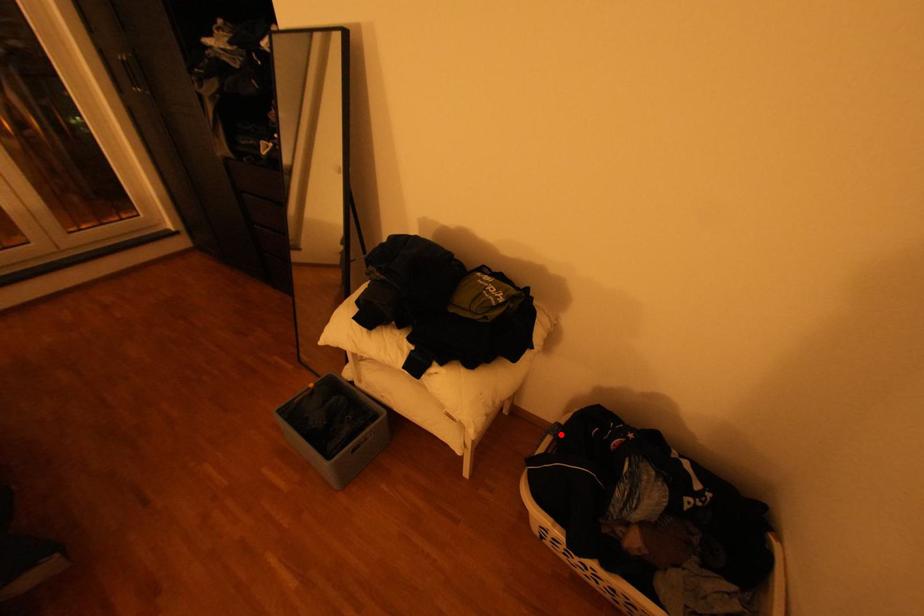
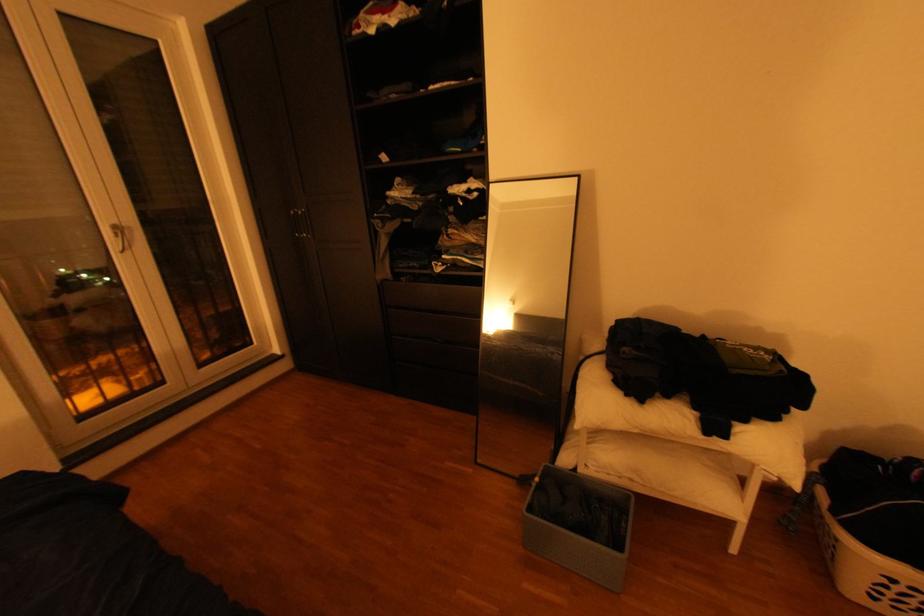
Question: I am providing you with two images of the same scene from different viewpoints. Image1 has a red point marked. In image2, the corresponding 3D location appears at what relative position? Reply with the corresponding letter.

Choices:
 (A) Closer
 (B) Farther

Answer: (B)